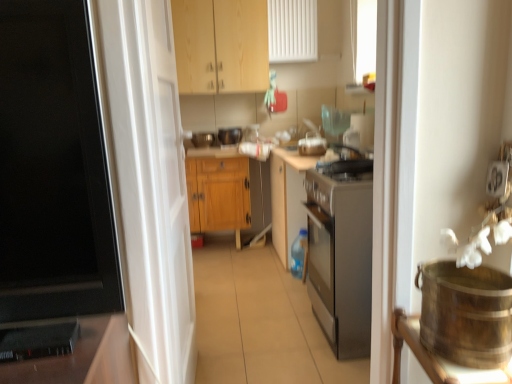
Question: Is wooden cabinet at upper center, acting as the 2th cabinetry starting from the bottom, inside wooden cabinet at center, acting as the 1th cabinetry starting from the bottom?

Choices:
 (A) no
 (B) yes

Answer: (A)

Question: From the image's perspective, does wooden cabinet at center, which is the second cabinetry in top-to-bottom order, appear lower than wooden cabinet at upper center, arranged as the first cabinetry when viewed from the top?

Choices:
 (A) no
 (B) yes

Answer: (B)

Question: Considering the relative sizes of wooden cabinet at center, acting as the 1th cabinetry starting from the bottom, and wooden cabinet at upper center, arranged as the first cabinetry when viewed from the top, in the image provided, is wooden cabinet at center, acting as the 1th cabinetry starting from the bottom, taller than wooden cabinet at upper center, arranged as the first cabinetry when viewed from the top,?

Choices:
 (A) no
 (B) yes

Answer: (B)

Question: Considering the relative sizes of wooden cabinet at center, acting as the 1th cabinetry starting from the bottom, and wooden cabinet at upper center, acting as the 2th cabinetry starting from the bottom, in the image provided, is wooden cabinet at center, acting as the 1th cabinetry starting from the bottom, shorter than wooden cabinet at upper center, acting as the 2th cabinetry starting from the bottom,?

Choices:
 (A) no
 (B) yes

Answer: (A)

Question: Is wooden cabinet at center, which is the second cabinetry in top-to-bottom order, at the left side of wooden cabinet at upper center, arranged as the first cabinetry when viewed from the top?

Choices:
 (A) yes
 (B) no

Answer: (A)

Question: Considering the positions of black plastic speaker at lower left and wooden cabinet at center, which is the second cabinetry in top-to-bottom order, in the image, is black plastic speaker at lower left bigger or smaller than wooden cabinet at center, which is the second cabinetry in top-to-bottom order,?

Choices:
 (A) small
 (B) big

Answer: (A)

Question: Is point (20, 354) positioned closer to the camera than point (228, 211)?

Choices:
 (A) farther
 (B) closer

Answer: (B)

Question: Considering the relative positions of black plastic speaker at lower left and wooden cabinet at center, acting as the 1th cabinetry starting from the bottom, in the image provided, is black plastic speaker at lower left to the left or to the right of wooden cabinet at center, acting as the 1th cabinetry starting from the bottom,?

Choices:
 (A) left
 (B) right

Answer: (A)

Question: In terms of width, does black plastic speaker at lower left look wider or thinner when compared to wooden cabinet at center, which is the second cabinetry in top-to-bottom order?

Choices:
 (A) thin
 (B) wide

Answer: (A)

Question: Visually, is wooden cabinet at center, which is the second cabinetry in top-to-bottom order, positioned to the left or to the right of white glossy door at center?

Choices:
 (A) right
 (B) left

Answer: (B)

Question: From a real-world perspective, is wooden cabinet at center, which is the second cabinetry in top-to-bottom order, physically located above or below white glossy door at center?

Choices:
 (A) below
 (B) above

Answer: (A)

Question: Would you say wooden cabinet at center, which is the second cabinetry in top-to-bottom order, is inside or outside white glossy door at center?

Choices:
 (A) inside
 (B) outside

Answer: (B)

Question: From the image's perspective, relative to white glossy door at center, is wooden cabinet at center, acting as the 1th cabinetry starting from the bottom, above or below?

Choices:
 (A) above
 (B) below

Answer: (A)

Question: Considering the positions of white glossy door at center and wooden cabinet at center, acting as the 1th cabinetry starting from the bottom, in the image, is white glossy door at center taller or shorter than wooden cabinet at center, acting as the 1th cabinetry starting from the bottom,?

Choices:
 (A) short
 (B) tall

Answer: (B)

Question: From a real-world perspective, is white glossy door at center positioned above or below wooden cabinet at center, acting as the 1th cabinetry starting from the bottom?

Choices:
 (A) below
 (B) above

Answer: (B)